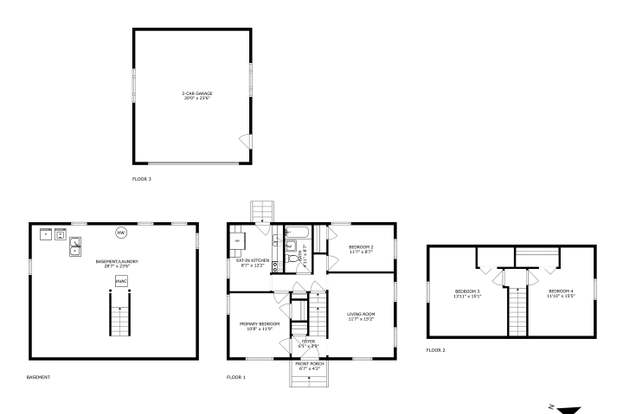
You are a GUI agent. You are given a task and a screenshot of the screen. Output one action in this format:
    pyautogui.click(x=<x>, y=<y>)
    Task: Click on the floor plan
    The width and height of the screenshot is (623, 414).
    Given the screenshot: What is the action you would take?
    pyautogui.click(x=120, y=265), pyautogui.click(x=316, y=269), pyautogui.click(x=195, y=111), pyautogui.click(x=495, y=306)